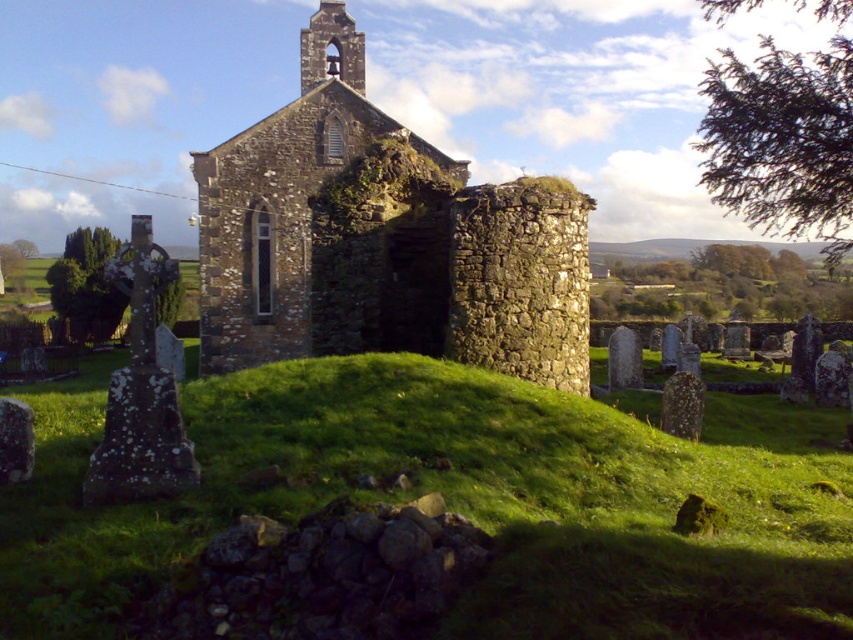
Is point (805, 486) in front of point (425, 272)?

That is True.

Is green grassy mound at center wider than rustic stone church at center?

Yes, green grassy mound at center is wider than rustic stone church at center.

Does point (553, 406) lie in front of point (556, 205)?

Yes, point (553, 406) is in front of point (556, 205).

Locate an element on the screen. The image size is (853, 640). green grassy mound at center is located at coordinates (461, 500).